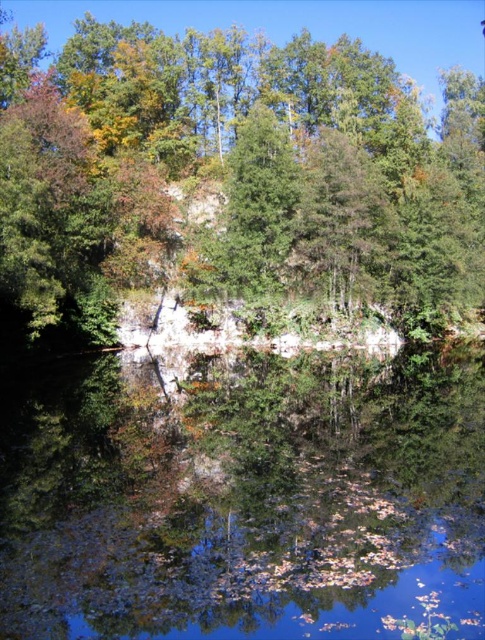
Can you confirm if clear water at center is positioned to the right of green matte tree at upper center?

Indeed, clear water at center is positioned on the right side of green matte tree at upper center.

Consider the image. Between clear water at center and green matte tree at upper center, which one appears on the left side from the viewer's perspective?

green matte tree at upper center is more to the left.

Which is in front, point (190, 477) or point (380, 144)?

Positioned in front is point (190, 477).

What are the coordinates of `clear water at center` in the screenshot? It's located at (244, 499).